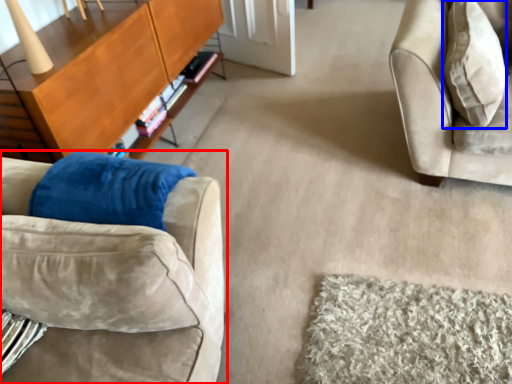
Question: Which object is closer to the camera taking this photo, studio couch (highlighted by a red box) or throw pillow (highlighted by a blue box)?

Choices:
 (A) studio couch
 (B) throw pillow

Answer: (A)